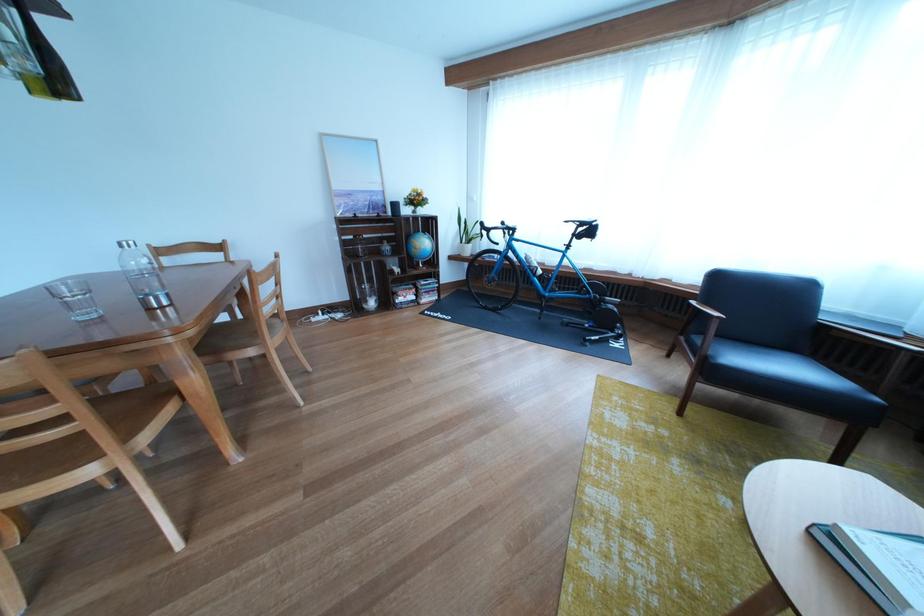
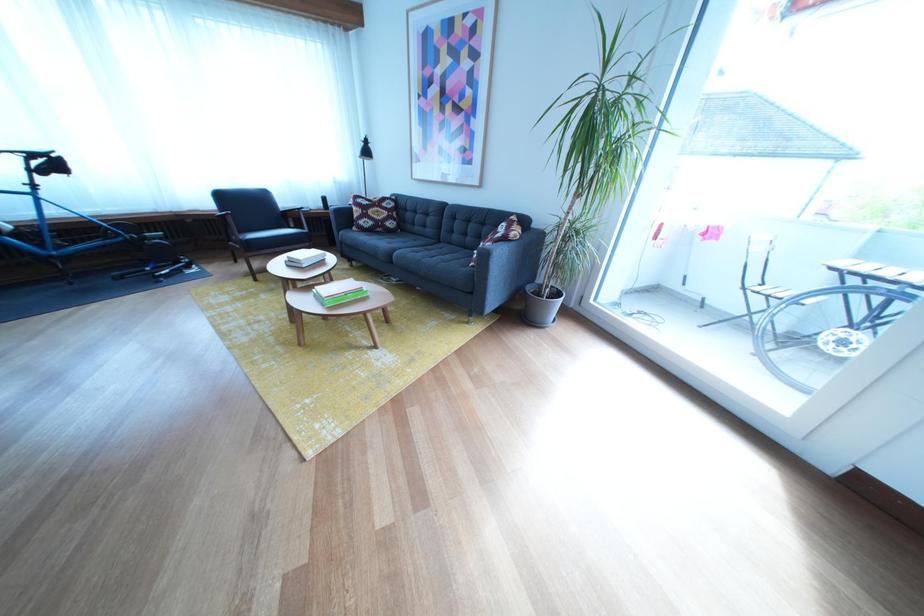
Where in the second image is the point corresponding to (x=602, y=237) from the first image?

(64, 169)